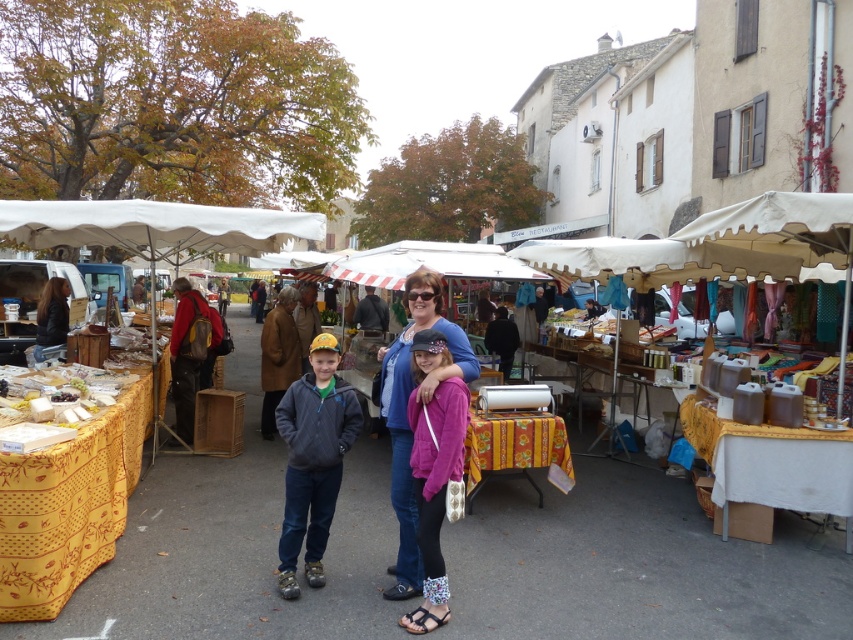
Question: Which of these objects is positioned farthest from the blue cotton shirt at center?

Choices:
 (A) yellow fabric tablecloth at center
 (B) white fabric canopy at left
 (C) matte blue sweater at center

Answer: (B)

Question: Based on their relative distances, which object is nearer to the dark brown leather jacket at left?

Choices:
 (A) white fabric canopy at left
 (B) blue cotton shirt at center
 (C) yellow fabric tablecloth at center

Answer: (A)

Question: Can you confirm if yellow fabric tablecloth at center is wider than blue cotton shirt at center?

Choices:
 (A) yes
 (B) no

Answer: (A)

Question: In this image, where is yellow fabric tablecloth at center located relative to blue cotton shirt at center?

Choices:
 (A) right
 (B) left

Answer: (B)

Question: Can you confirm if blue cotton shirt at center is thinner than matte blue sweater at center?

Choices:
 (A) yes
 (B) no

Answer: (B)

Question: Which of the following is the closest to the observer?

Choices:
 (A) (469, 374)
 (B) (213, 209)
 (C) (425, 273)
 (D) (57, 282)

Answer: (A)